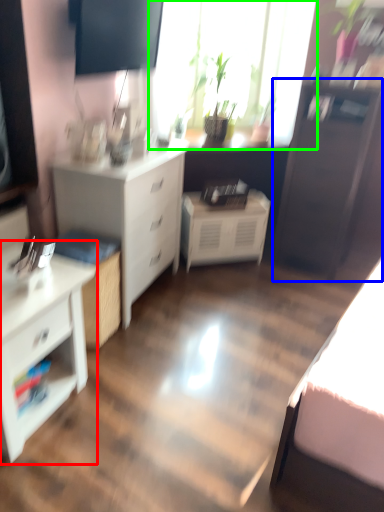
Question: Considering the real-world distances, which object is farthest from chest of drawers (highlighted by a red box)? file cabinet (highlighted by a blue box) or window (highlighted by a green box)?

Choices:
 (A) file cabinet
 (B) window

Answer: (B)